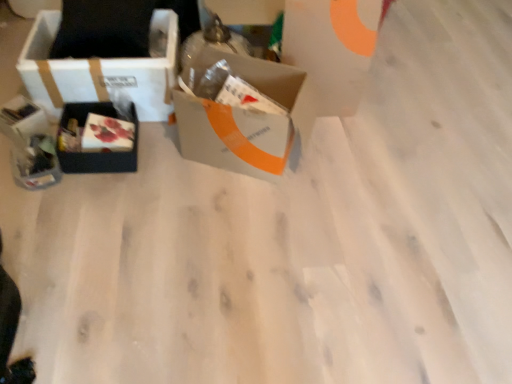
Where is `free spot in front of matte black gift box at left, the 1th gift box from the top`? Image resolution: width=512 pixels, height=384 pixels. free spot in front of matte black gift box at left, the 1th gift box from the top is located at coordinates (10, 161).